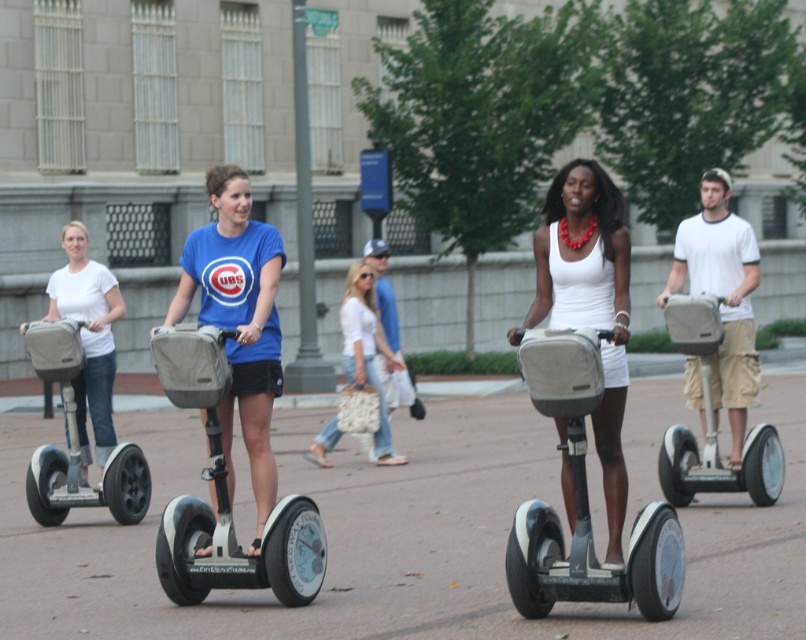
You are a photographer standing in the urban setting shown. You notice the white matte tank top at center and the white matte segway at center. Which object is positioned higher in the image?

The white matte tank top at center is above the white matte segway at center, so it is positioned higher in the image.

You are a photographer positioned at the edge of the scene. You want to capture a photo that includes both the white matte tank top at center and the white matte segway at center. Based on their positions, which object should you adjust your camera to focus on first to ensure both are in frame?

The white matte tank top at center is to the right of the white matte segway at center. To ensure both are in frame, focus on the white matte segway at center first since it is on the left, allowing the camera to capture the tank top on the right as well.